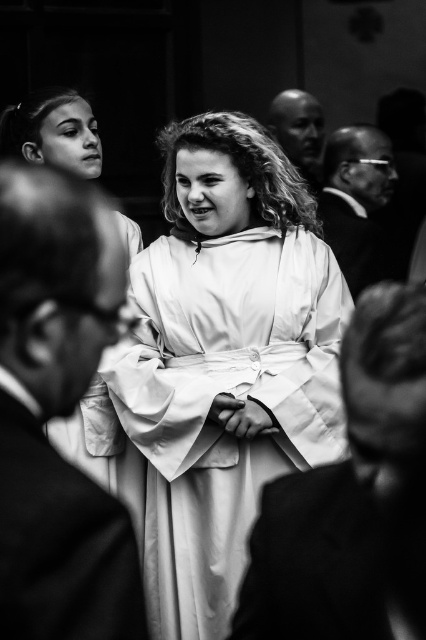
In the scene shown: You are a photographer trying to capture a closeup of the white smooth robe at center and the smooth black glasses at right. Since you can only focus on one object at a time, which object should you focus on first if you want to ensure the closest subject is in focus?

The white smooth robe at center should be focused on first because it is closer to the photographer than the smooth black glasses at right, which is further away.